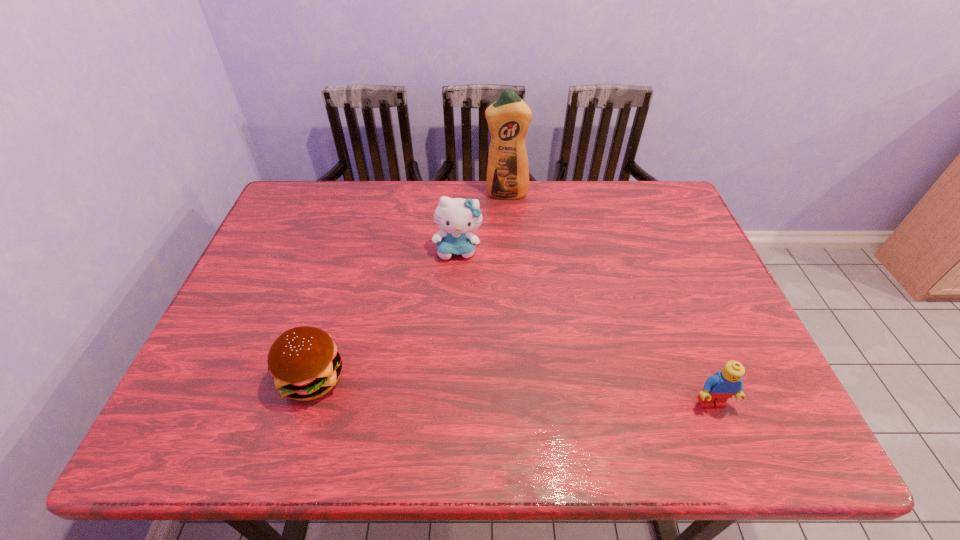
Image resolution: width=960 pixels, height=540 pixels. I want to click on free space between the leftmost object and the farthest object, so click(409, 286).

You are a GUI agent. You are given a task and a screenshot of the screen. Output one action in this format:
    pyautogui.click(x=<x>, y=<y>)
    Task: Click on the unoccupied area between the Lego and the second object from left to right
    The height and width of the screenshot is (540, 960).
    Given the screenshot: What is the action you would take?
    pyautogui.click(x=585, y=326)

Identify the location of unoccupied position between the tallest object and the second tallest object. (482, 222).

This screenshot has width=960, height=540. I want to click on object that is the nearest to the Lego, so click(456, 216).

Select which object is the third closest to the rightmost object. Please provide its 2D coordinates. Your answer should be formatted as a tuple, i.e. [(x, y)], where the tuple contains the x and y coordinates of a point satisfying the conditions above.

[(508, 118)]

Where is `free region that satisfies the following two spatial constraints: 1. on the back side of the farthest object; 2. on the right side of the leftmost object`? The width and height of the screenshot is (960, 540). free region that satisfies the following two spatial constraints: 1. on the back side of the farthest object; 2. on the right side of the leftmost object is located at coordinates (367, 194).

Locate an element on the screen. vacant space that satisfies the following two spatial constraints: 1. on the back side of the third nearest object; 2. on the right side of the hamburger is located at coordinates (350, 249).

The width and height of the screenshot is (960, 540). Find the location of `free spot that satisfies the following two spatial constraints: 1. on the back side of the leftmost object; 2. on the left side of the detergent`. free spot that satisfies the following two spatial constraints: 1. on the back side of the leftmost object; 2. on the left side of the detergent is located at coordinates click(x=367, y=194).